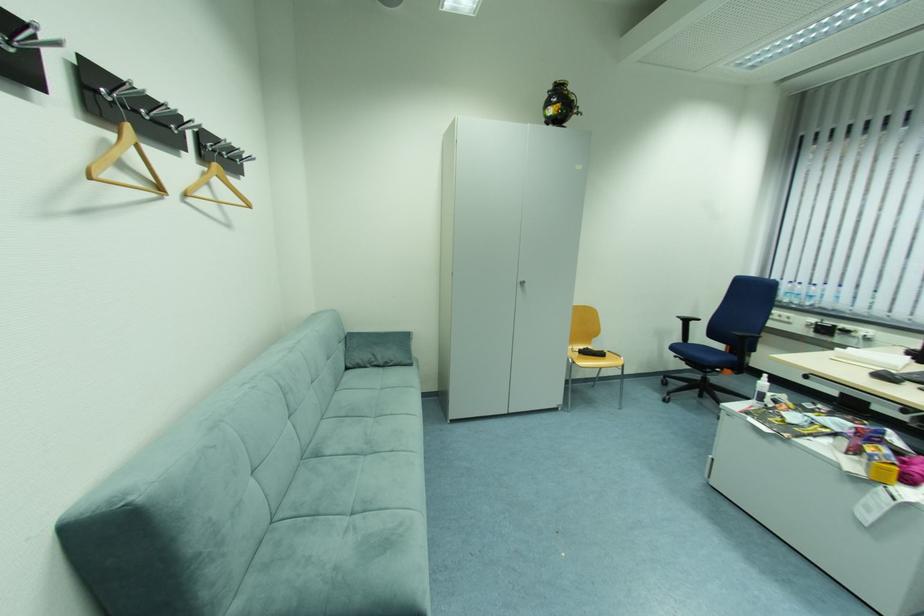
Where is `blue chair sitting surface`? blue chair sitting surface is located at coordinates (706, 355).